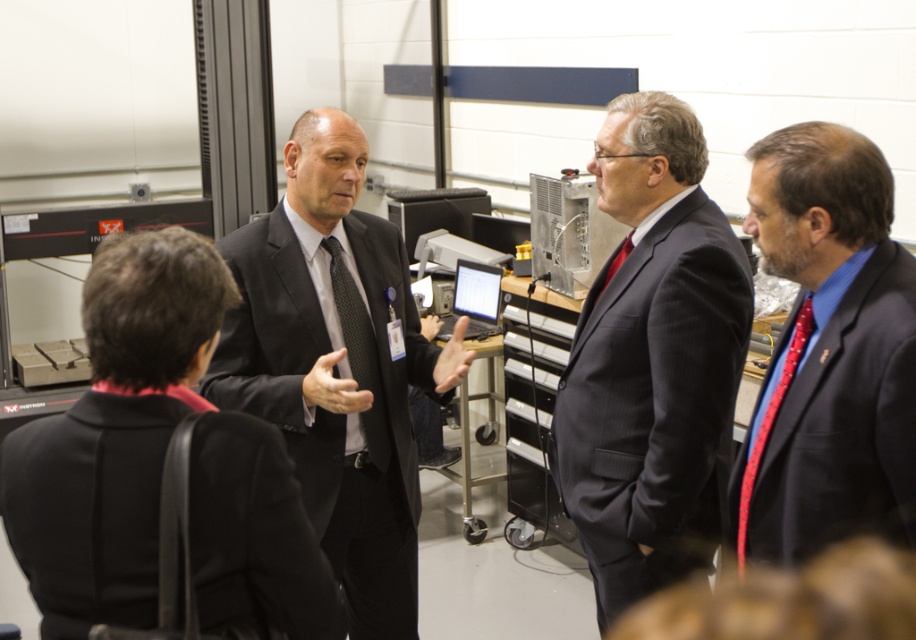
Question: Does dark blue pinstripe suit at center have a lesser width compared to red silk tie at center?

Choices:
 (A) no
 (B) yes

Answer: (A)

Question: Which object appears farthest from the camera in this image?

Choices:
 (A) red silk tie at right
 (B) black matte suit at center
 (C) matte black suit at center
 (D) black dotted tie at center

Answer: (D)

Question: Does dark blue pinstripe suit at center appear under black dotted tie at center?

Choices:
 (A) no
 (B) yes

Answer: (B)

Question: Which point appears farthest from the camera in this image?

Choices:
 (A) (661, 376)
 (B) (878, 225)
 (C) (364, 330)

Answer: (C)

Question: Estimate the real-world distances between objects in this image. Which object is farther from the matte black suit at center?

Choices:
 (A) black matte suit at center
 (B) dark blue pinstripe suit at center

Answer: (A)

Question: Can you confirm if black dotted tie at center is positioned below red silk tie at center?

Choices:
 (A) no
 (B) yes

Answer: (B)